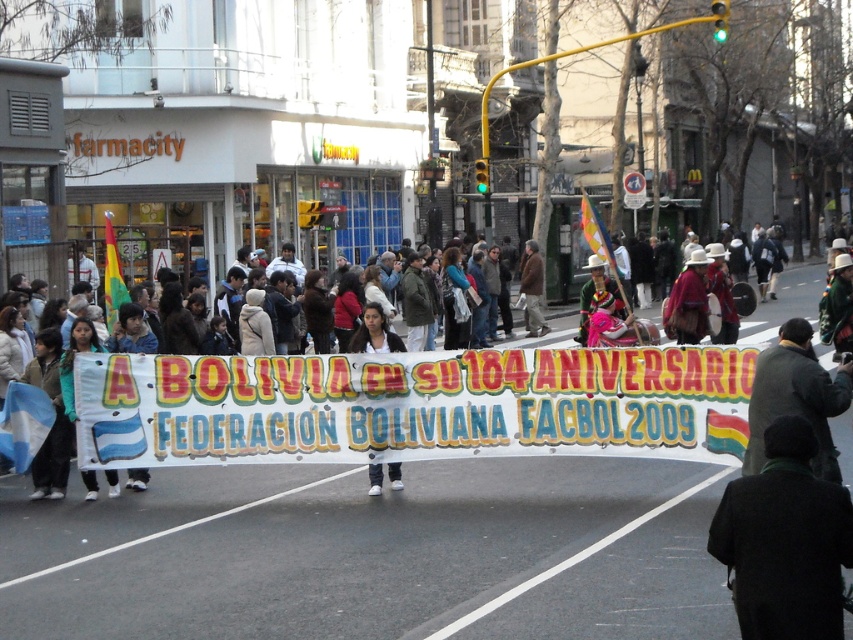
Question: Can you confirm if white paper banner at center is smaller than matte black jacket at center?

Choices:
 (A) no
 (B) yes

Answer: (A)

Question: Based on their relative distances, which object is nearer to the white paper banner at center?

Choices:
 (A) brown fuzzy coat at center
 (B) matte brown dress at center

Answer: (B)

Question: Which object is positioned farthest from the white paper banner at center?

Choices:
 (A) matte brown dress at center
 (B) black wool coat at lower right
 (C) brown fuzzy coat at center

Answer: (C)

Question: Is white paper banner at center positioned behind white fabric banner at center?

Choices:
 (A) yes
 (B) no

Answer: (B)

Question: Is black wool coat at lower right wider than white fabric banner at center?

Choices:
 (A) yes
 (B) no

Answer: (A)

Question: Which object appears closest to the camera in this image?

Choices:
 (A) matte black jacket at center
 (B) matte brown dress at center
 (C) black wool coat at lower right
 (D) white paper banner at center

Answer: (C)